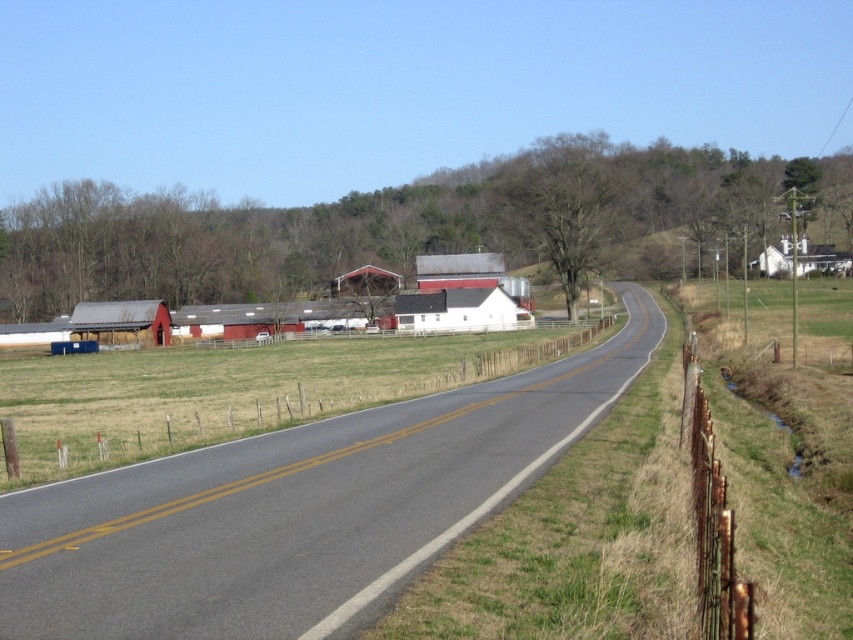
Is point (79, 314) farther from camera compared to point (770, 266)?

No.

Image resolution: width=853 pixels, height=640 pixels. What do you see at coordinates (120, 323) in the screenshot? I see `matte red barn at left` at bounding box center [120, 323].

Identify the location of matte red barn at left. (120, 323).

Can you confirm if red barn at center is positioned to the left of white matte barn at center?

Incorrect, red barn at center is not on the left side of white matte barn at center.

From the picture: Is red barn at center below white matte barn at center?

Indeed, red barn at center is positioned under white matte barn at center.

You are a GUI agent. You are given a task and a screenshot of the screen. Output one action in this format:
    pyautogui.click(x=<x>, y=<y>)
    Task: Click on the red barn at center
    This screenshot has width=853, height=640.
    Given the screenshot: What is the action you would take?
    pyautogui.click(x=297, y=508)

Does white matte barn at center have a greater height compared to matte red barn at left?

No.

Does white matte barn at center appear on the right side of matte red barn at left?

Correct, you'll find white matte barn at center to the right of matte red barn at left.

What do you see at coordinates (459, 310) in the screenshot?
I see `white matte barn at center` at bounding box center [459, 310].

Locate an element on the screen. white matte barn at center is located at coordinates (459, 310).